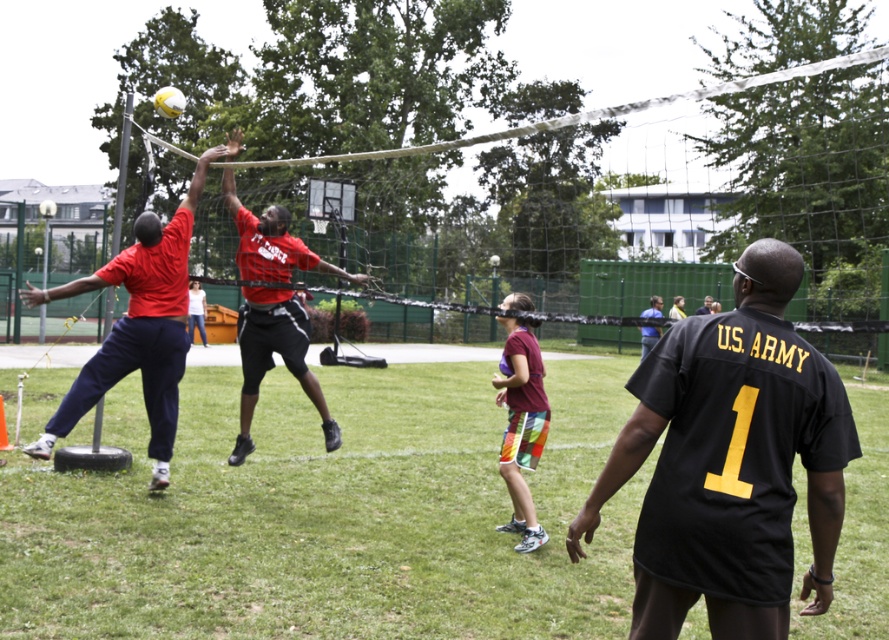
You are a volleyball coach observing the game. You need to ensure players maintain a minimum distance of 2 meters apart for safety during drills. Can the red matte shirt at center and maroon fabric shorts at center maintain this requirement?

The distance between red matte shirt at center and maroon fabric shorts at center is 2.47 meters, which exceeds the 2 meters requirement. Therefore, they are maintaining the required safety distance.

You are a photographer positioned at the origin of the coordinate system in the image. You want to take a photo of the matte red shirt at center. What are the coordinates where you should aim your camera?

The coordinates to aim your camera are at point (137,326).

You are a photographer trying to capture the action of the volleyball game. You notice the matte red shirt at center and the maroon fabric shorts at center. Which object should you focus on to ensure the subject is in the foreground of your photo?

The matte red shirt at center is located above the maroon fabric shorts at center, so focusing on the matte red shirt at center would ensure the subject is in the foreground since it is higher in the frame.